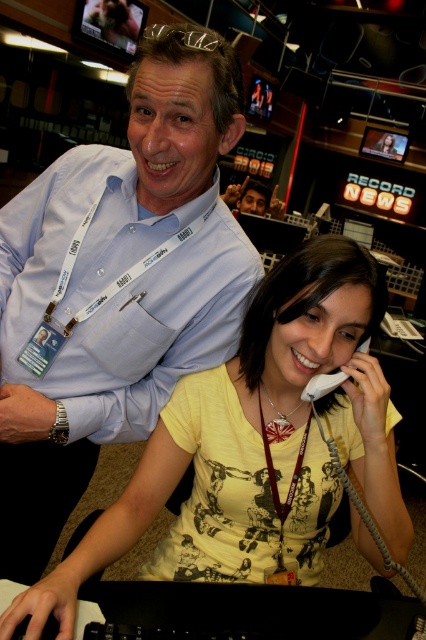
Question: Does glassy black monitor at upper right appear under matte plastic monitor at upper center?

Choices:
 (A) yes
 (B) no

Answer: (A)

Question: Is glassy black monitor at upper right further to the viewer compared to white plastic phone at upper right?

Choices:
 (A) no
 (B) yes

Answer: (B)

Question: Which point is closer to the camera taking this photo?

Choices:
 (A) (250, 186)
 (B) (368, 544)
 (C) (25, 388)
 (D) (259, 113)

Answer: (C)

Question: Does metallic glossy monitor at upper left come in front of matte plastic monitor at upper center?

Choices:
 (A) yes
 (B) no

Answer: (A)

Question: Based on their relative distances, which object is farther from the metallic glossy monitor at upper left?

Choices:
 (A) matte black phone at upper center
 (B) matte blue shirt at center

Answer: (B)

Question: Which of the following is the closest to the observer?

Choices:
 (A) (137, 38)
 (B) (264, 573)

Answer: (B)